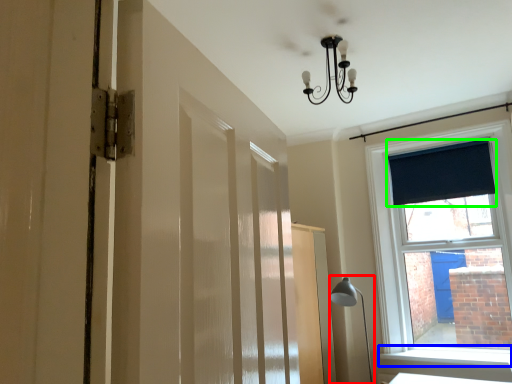
Question: Estimate the real-world distances between objects in this image. Which object is closer to table lamp (highlighted by a red box), window sill (highlighted by a blue box) or curtain (highlighted by a green box)?

Choices:
 (A) window sill
 (B) curtain

Answer: (A)